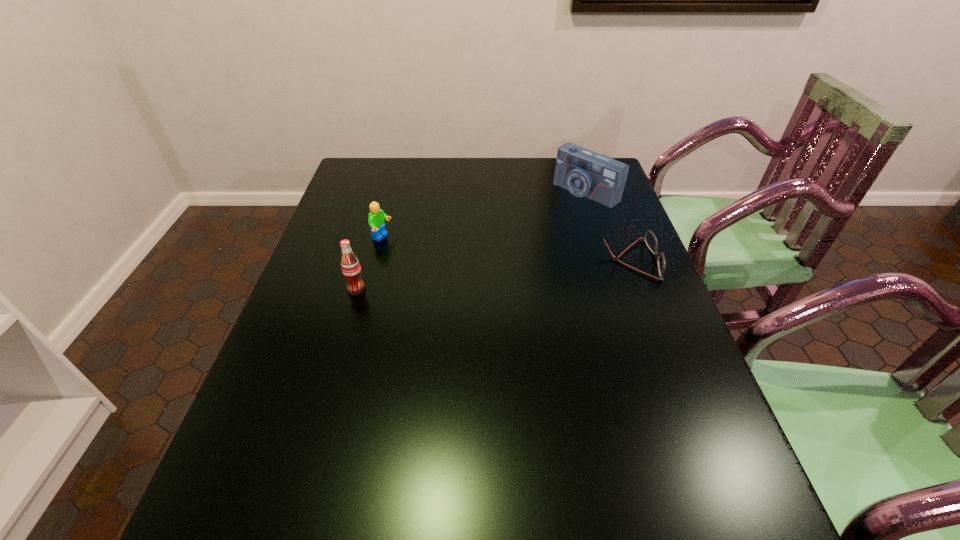
This screenshot has height=540, width=960. What are the coordinates of `blank space at the right edge of the desktop` in the screenshot? It's located at (653, 350).

Locate an element on the screen. vacant space at the far left corner of the desktop is located at coordinates tap(355, 166).

Identify the location of empty space that is in between the spectacles and the soda. This screenshot has width=960, height=540. (493, 274).

Identify the location of free space between the camera and the soda. This screenshot has width=960, height=540. (471, 241).

Where is `vacant area that lies between the spectacles and the Lego`? The height and width of the screenshot is (540, 960). vacant area that lies between the spectacles and the Lego is located at coordinates (506, 249).

Locate an element on the screen. The width and height of the screenshot is (960, 540). free spot between the second shortest object and the farthest object is located at coordinates (484, 215).

Where is `vacant space that is in between the nearest object and the shortest object`? vacant space that is in between the nearest object and the shortest object is located at coordinates (493, 274).

In order to click on free area in between the farthest object and the soda in this screenshot , I will do `click(471, 241)`.

You are a GUI agent. You are given a task and a screenshot of the screen. Output one action in this format:
    pyautogui.click(x=<x>, y=<y>)
    Task: Click on the free spot between the farthest object and the Lego
    
    Given the screenshot: What is the action you would take?
    pyautogui.click(x=484, y=215)

At what (x,y) coordinates should I click in order to perform the action: click on unoccupied area between the Lego and the soda. Please return your answer as a coordinate pair (x, y). Image resolution: width=960 pixels, height=540 pixels. Looking at the image, I should click on (370, 264).